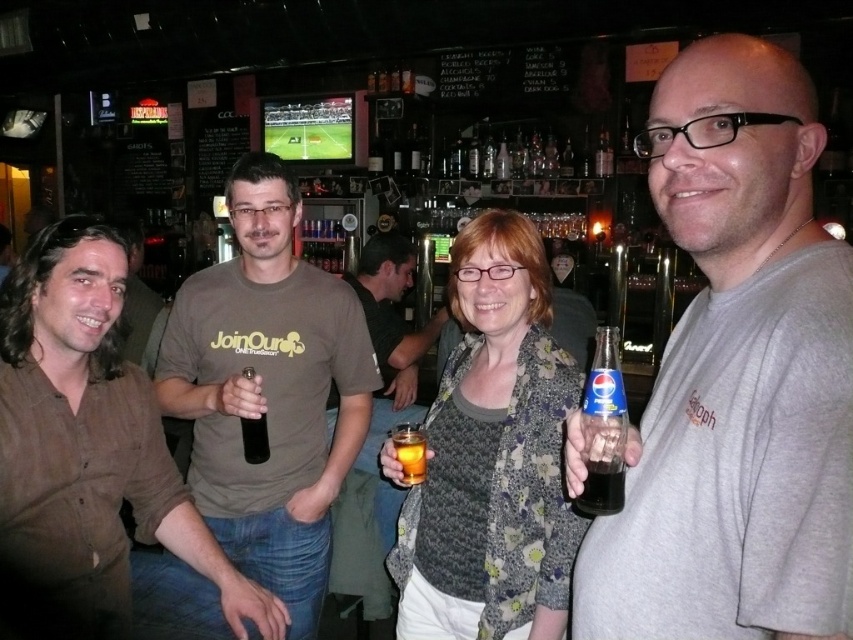
Question: Which point is closer to the camera?

Choices:
 (A) (112, 618)
 (B) (601, 472)
 (C) (125, 225)
 (D) (265, 500)

Answer: (B)

Question: Does matte brown t-shirt at center appear over dark glass bottle at right?

Choices:
 (A) no
 (B) yes

Answer: (A)

Question: Which object appears closest to the camera in this image?

Choices:
 (A) brown cotton shirt at left
 (B) clear glass bottle at right
 (C) gray matte shirt at center
 (D) black glass bottle at center

Answer: (C)

Question: Is matte brown t-shirt at center above brown cotton shirt at left?

Choices:
 (A) yes
 (B) no

Answer: (B)

Question: Which point is closer to the camera?

Choices:
 (A) (519, 456)
 (B) (595, 364)

Answer: (B)

Question: Where is brown shirt at left located in relation to brown cotton shirt at left in the image?

Choices:
 (A) above
 (B) below

Answer: (B)